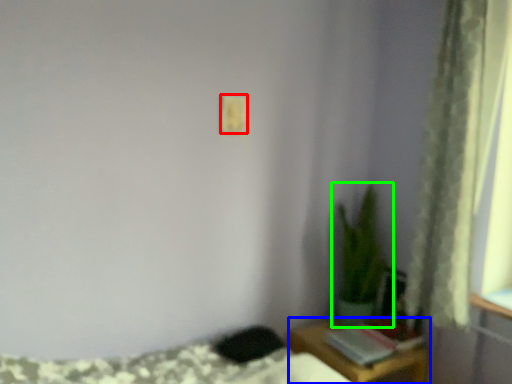
Question: Which is nearer to the light switch (highlighted by a red box)? table (highlighted by a blue box) or houseplant (highlighted by a green box).

Choices:
 (A) table
 (B) houseplant

Answer: (B)